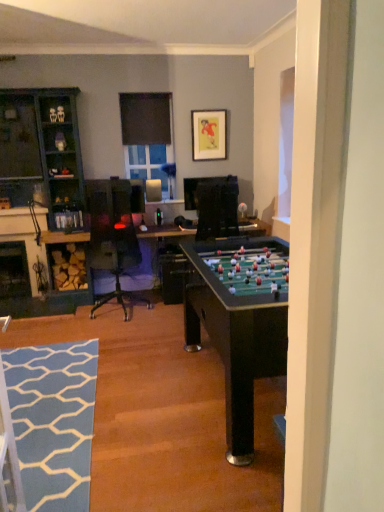
Question: Does point (61, 100) appear closer or farther from the camera than point (61, 488)?

Choices:
 (A) farther
 (B) closer

Answer: (A)

Question: Do you think teal wood cabinet at left is within blue textured rug at lower left, or outside of it?

Choices:
 (A) outside
 (B) inside

Answer: (A)

Question: Which is farther from the matte black picture frame at upper center?

Choices:
 (A) black matte window screen at upper center, the 1th window screen viewed from the top
 (B) blue textured rug at lower left
 (C) teal wood cabinet at left
 (D) black glass fireplace at lower left
 (E) clear glass window at upper center, the 2th window screen when ordered from top to bottom

Answer: (B)

Question: Which object is the farthest from the clear glass window at upper center, the 2th window screen when ordered from top to bottom?

Choices:
 (A) blue textured rug at lower left
 (B) black glass fireplace at lower left
 (C) black matte window screen at upper center, the 1th window screen viewed from the top
 (D) matte black picture frame at upper center
 (E) teal wood cabinet at left

Answer: (A)